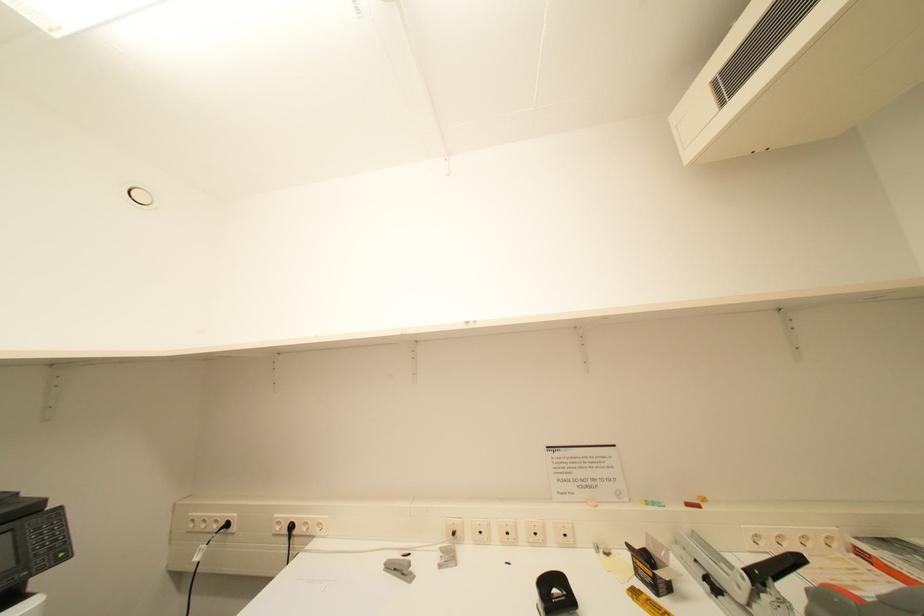
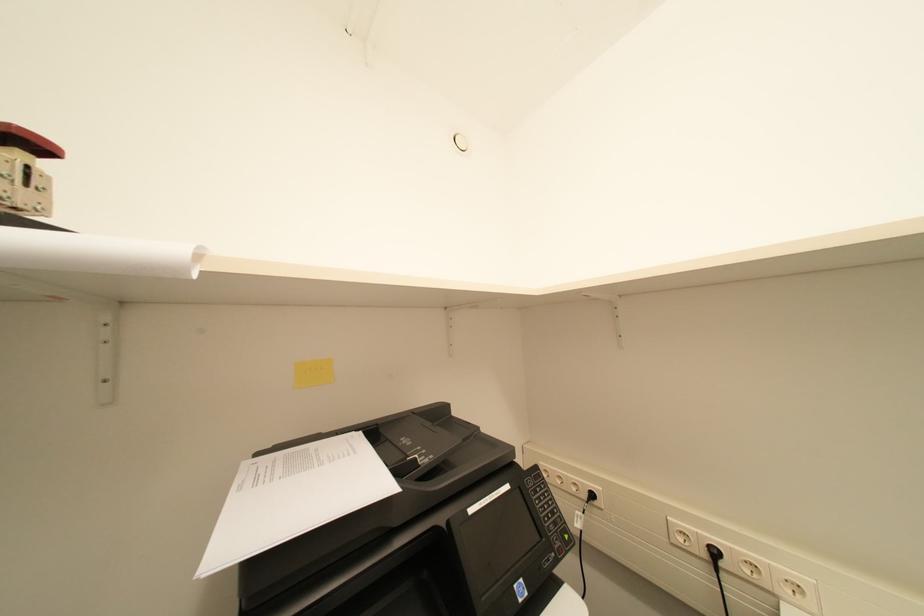
Question: The images are taken continuously from a first-person perspective. In which direction is your viewpoint rotating?

Choices:
 (A) Left
 (B) Right
 (C) Up
 (D) Down

Answer: (A)